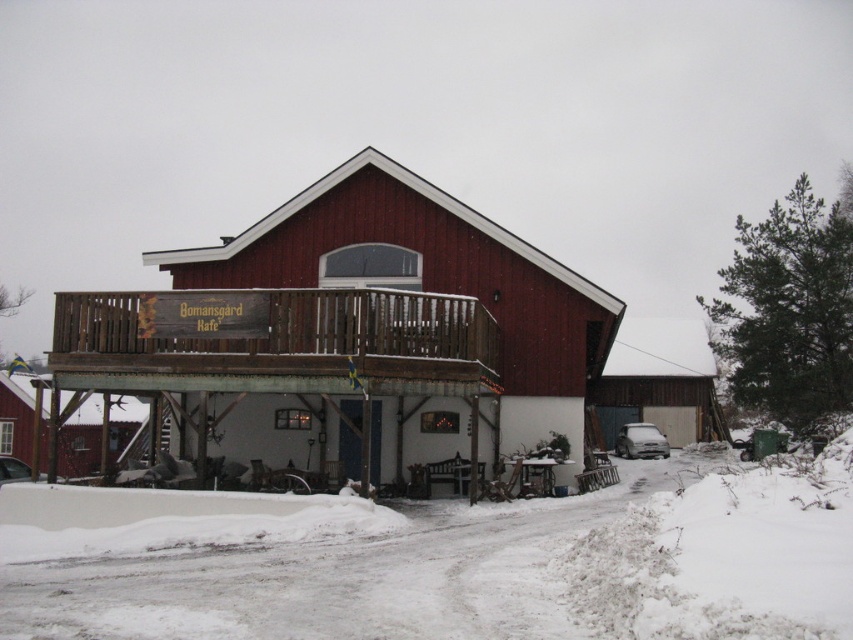
You are standing at the edge of the snowy area and want to walk to the matte red barn at center. Which direction should you head relative to the white powdery snow at lower center?

You should head to the left side of the white powdery snow at lower center because the matte red barn at center is positioned there.

You are standing at the entrance of Bomansgard Kafe and want to take a photo of the point at coordinates (x=552, y=378). If the camera you are using has a maximum focus range of 20 meters, will you be able to capture the point clearly?

The distance of point (x=552, y=378) from the camera is 20.46 meters, which exceeds the camera maximum focus range of 20 meters. Therefore, the point will be out of focus and not captured clearly.

You are standing at the entrance of Bomansgard Kafe and want to take a photo of two specific points marked in the image. The first point is at coordinates point (519, 445) and the second point is at point (672, 474). Which point should you focus on first if you want to capture both points in a single frame without moving your camera?

You should focus on point (519, 445) first because it is closer to the viewer than point (672, 474), allowing both points to be captured in the frame when adjusting the camera angle appropriately.